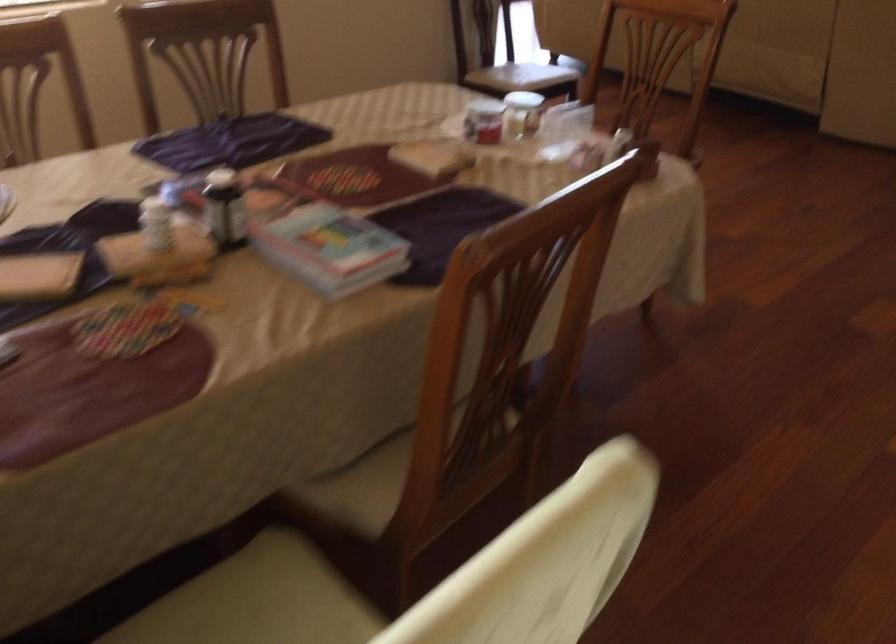
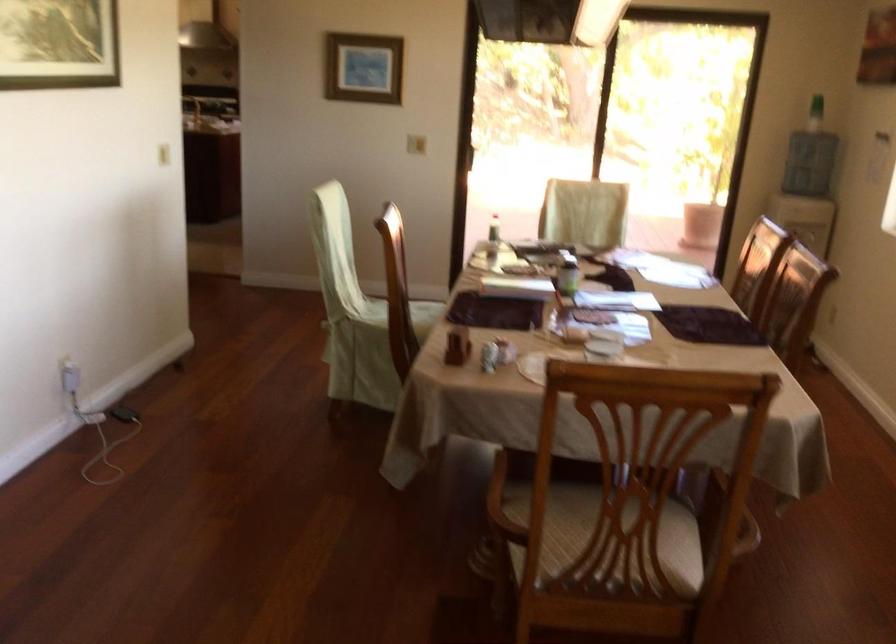
Where in the second image is the point corresponding to (708,527) from the first image?

(316, 540)